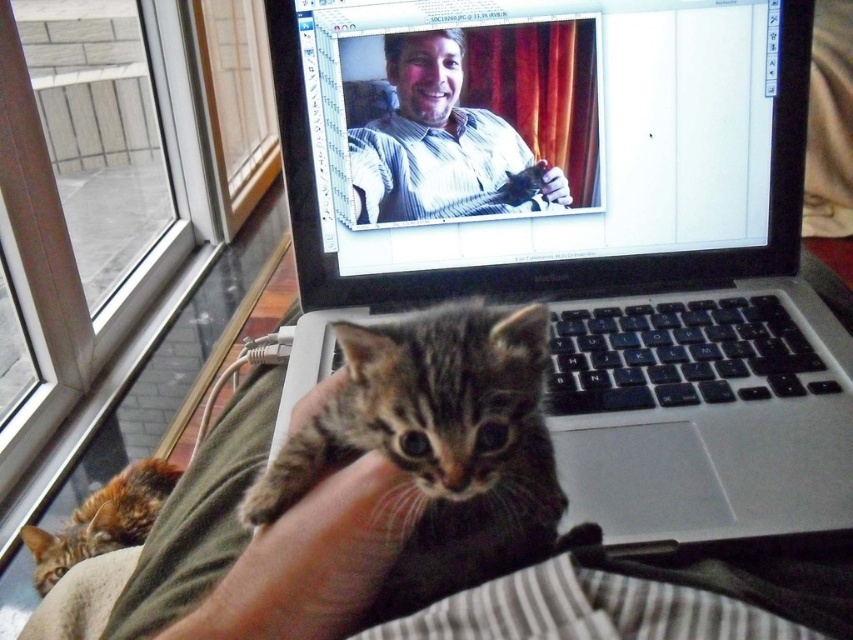
Question: Does silver/black plastic laptop at center lie behind fluffy gray kitten at center?

Choices:
 (A) no
 (B) yes

Answer: (B)

Question: Which of the following is the closest to the observer?

Choices:
 (A) click(271, 464)
 (B) click(711, 129)

Answer: (A)

Question: Can you confirm if matte striped shirt at center is bigger than fluffy gray kitten at center?

Choices:
 (A) no
 (B) yes

Answer: (A)

Question: Which object is closer to the camera taking this photo?

Choices:
 (A) silver/black plastic laptop at center
 (B) matte plastic laptop at center
 (C) tabby fur kitten at center
 (D) tabby fur cat at lower left

Answer: (C)

Question: Where is matte plastic laptop at center located in relation to matte striped shirt at center in the image?

Choices:
 (A) above
 (B) below

Answer: (A)

Question: Which of the following is the farthest from the observer?

Choices:
 (A) (732, 157)
 (B) (849, 340)

Answer: (A)